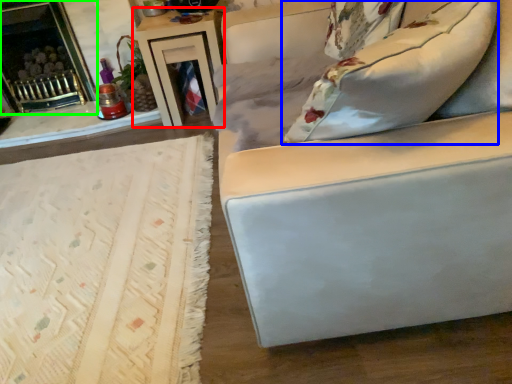
Question: Considering the real-world distances, which object is farthest from table (highlighted by a red box)? pillow (highlighted by a blue box) or fireplace (highlighted by a green box)?

Choices:
 (A) pillow
 (B) fireplace

Answer: (A)